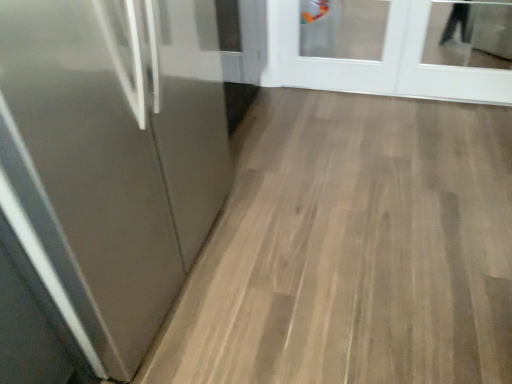
Question: Looking at the image, does glossy metallic door at left, which is the 2th door in back-to-front order, seem bigger or smaller compared to white glossy door at upper right, the 2th door when ordered from front to back?

Choices:
 (A) big
 (B) small

Answer: (A)

Question: Does point (33, 185) appear closer or farther from the camera than point (415, 79)?

Choices:
 (A) closer
 (B) farther

Answer: (A)

Question: From the image's perspective, relative to white glossy door at upper right, the 2th door when ordered from front to back, is glossy metallic door at left, placed as the 1th door when sorted from left to right, above or below?

Choices:
 (A) above
 (B) below

Answer: (B)

Question: Based on their sizes in the image, would you say white glossy door at upper right, which appears as the first door when viewed from the right, is bigger or smaller than glossy metallic door at left, which ranks as the first door in front-to-back order?

Choices:
 (A) small
 (B) big

Answer: (A)

Question: In terms of width, does white glossy door at upper right, the second door positioned from the left, look wider or thinner when compared to glossy metallic door at left, the 2th door positioned from the right?

Choices:
 (A) thin
 (B) wide

Answer: (A)

Question: From a real-world perspective, relative to glossy metallic door at left, the 2th door positioned from the right, is white glossy door at upper right, the 2th door when ordered from front to back, vertically above or below?

Choices:
 (A) above
 (B) below

Answer: (B)

Question: Considering their positions, is white glossy door at upper right, the 2th door when ordered from front to back, located in front of or behind glossy metallic door at left, which is the 2th door in back-to-front order?

Choices:
 (A) behind
 (B) front

Answer: (A)